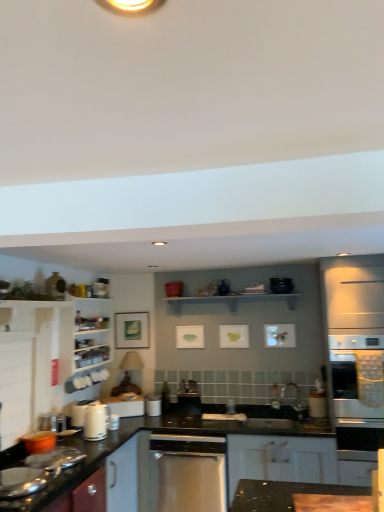
Describe the element at coordinates (317, 404) in the screenshot. I see `white glossy microwave at right, arranged as the first appliance when viewed from the front` at that location.

What is the approximate width of stainless steel oven at right?

The width of stainless steel oven at right is 64.22 centimeters.

Measure the distance between satin stainless steel dishwasher at center and camera.

A distance of 3.15 meters exists between satin stainless steel dishwasher at center and camera.

Locate an element on the screen. black glossy countertop at lower left, which is the 1th countertop in back-to-front order is located at coordinates (79, 464).

Is point (320, 399) farther from viewer compared to point (6, 506)?

Yes, point (320, 399) is behind point (6, 506).

Is white glossy microwave at right, which ranks as the first appliance in right-to-left order, thinner than black glossy countertop at lower left, the 2th countertop viewed from the top?

Correct, the width of white glossy microwave at right, which ranks as the first appliance in right-to-left order, is less than that of black glossy countertop at lower left, the 2th countertop viewed from the top.

From a real-world perspective, is white glossy microwave at right, arranged as the 2th appliance when viewed from the back, above or below black glossy countertop at lower left, which ranks as the second countertop in right-to-left order?

white glossy microwave at right, arranged as the 2th appliance when viewed from the back, is above black glossy countertop at lower left, which ranks as the second countertop in right-to-left order.

Between brown wooden countertop at lower right, placed as the 2th countertop when sorted from bottom to top, and white glossy microwave at right, acting as the 2th appliance starting from the left, which one has less height?

Standing shorter between the two is brown wooden countertop at lower right, placed as the 2th countertop when sorted from bottom to top.

Is brown wooden countertop at lower right, the 1th countertop when ordered from front to back, bigger or smaller than white glossy microwave at right, which ranks as the first appliance in right-to-left order?

brown wooden countertop at lower right, the 1th countertop when ordered from front to back, is bigger than white glossy microwave at right, which ranks as the first appliance in right-to-left order.

In the image, is brown wooden countertop at lower right, which is the first countertop from top to bottom, positioned in front of or behind white glossy microwave at right, which ranks as the first appliance in right-to-left order?

brown wooden countertop at lower right, which is the first countertop from top to bottom, is positioned closer to the viewer than white glossy microwave at right, which ranks as the first appliance in right-to-left order.

From a real-world perspective, is brown wooden countertop at lower right, which appears as the 2th countertop when viewed from the back, positioned under white glossy microwave at right, acting as the 2th appliance starting from the left, based on gravity?

Correct, in the physical world, brown wooden countertop at lower right, which appears as the 2th countertop when viewed from the back, is lower than white glossy microwave at right, acting as the 2th appliance starting from the left.

From a real-world perspective, is white glossy microwave at right, arranged as the first appliance when viewed from the front, located higher than white glossy kettle at lower left?

Yes, from a real-world perspective, white glossy microwave at right, arranged as the first appliance when viewed from the front, is over white glossy kettle at lower left

Which is behind, white glossy microwave at right, which ranks as the first appliance in right-to-left order, or white glossy kettle at lower left?

white glossy microwave at right, which ranks as the first appliance in right-to-left order, is behind.

Considering the relative sizes of white glossy microwave at right, acting as the 2th appliance starting from the left, and white glossy kettle at lower left in the image provided, is white glossy microwave at right, acting as the 2th appliance starting from the left, shorter than white glossy kettle at lower left?

Indeed, white glossy microwave at right, acting as the 2th appliance starting from the left, has a lesser height compared to white glossy kettle at lower left.

Between point (312, 392) and point (89, 440), which one is positioned behind?

The point (312, 392) is farther from the camera.

Which of these two, black glossy countertop at lower left, which is counted as the first countertop, starting from the bottom, or white glossy microwave at right, acting as the 2th appliance starting from the left, is bigger?

With larger size is black glossy countertop at lower left, which is counted as the first countertop, starting from the bottom.

Measure the distance from black glossy countertop at lower left, the 2th countertop viewed from the top, to white glossy microwave at right, acting as the 2th appliance starting from the left.

black glossy countertop at lower left, the 2th countertop viewed from the top, is 1.83 meters away from white glossy microwave at right, acting as the 2th appliance starting from the left.

How different are the orientations of black glossy countertop at lower left, the first countertop from the left, and white glossy microwave at right, which ranks as the first appliance in right-to-left order, in degrees?

black glossy countertop at lower left, the first countertop from the left, and white glossy microwave at right, which ranks as the first appliance in right-to-left order, are facing 89.3 degrees away from each other.

From a real-world perspective, is black glossy countertop at lower left, the first countertop from the left, beneath white glossy microwave at right, arranged as the first appliance when viewed from the front?

Correct, in the physical world, black glossy countertop at lower left, the first countertop from the left, is lower than white glossy microwave at right, arranged as the first appliance when viewed from the front.

Is white glossy cabinet at left, which is counted as the 2th cabinetry, starting from the right, wider than white matte cabinet at lower center, which ranks as the second cabinetry in left-to-right order?

In fact, white glossy cabinet at left, which is counted as the 2th cabinetry, starting from the right, might be narrower than white matte cabinet at lower center, which ranks as the second cabinetry in left-to-right order.

Is white glossy cabinet at left, which is counted as the 2th cabinetry, starting from the right, far away from white matte cabinet at lower center, which ranks as the second cabinetry in left-to-right order?

Indeed, white glossy cabinet at left, which is counted as the 2th cabinetry, starting from the right, is not near white matte cabinet at lower center, which ranks as the second cabinetry in left-to-right order.

From a real-world perspective, is white glossy cabinet at left, which is the 2th cabinetry from bottom to top, beneath white matte cabinet at lower center, which ranks as the second cabinetry in left-to-right order?

No.

Considering the points (76, 359) and (316, 447), which point is behind, point (76, 359) or point (316, 447)?

Positioned behind is point (76, 359).

From a real-world perspective, which is physically above, stainless steel oven at right or white glossy kettle at lower left?

From a 3D spatial view, stainless steel oven at right is above.

From the image's perspective, is stainless steel oven at right located above or below white glossy kettle at lower left?

Clearly, from the image's perspective, stainless steel oven at right is above white glossy kettle at lower left.

How far apart are stainless steel oven at right and white glossy kettle at lower left?

stainless steel oven at right and white glossy kettle at lower left are 1.83 meters apart from each other.

Consider the image. Between stainless steel oven at right and white glossy kettle at lower left, which one has less height?

Standing shorter between the two is white glossy kettle at lower left.

Are white glossy microwave at right, acting as the 2th appliance starting from the left, and brown wooden countertop at lower right, which is counted as the first countertop, starting from the right, far apart?

No, white glossy microwave at right, acting as the 2th appliance starting from the left, is not far away from brown wooden countertop at lower right, which is counted as the first countertop, starting from the right.

Is white glossy microwave at right, acting as the 2th appliance starting from the left, positioned with its back to brown wooden countertop at lower right, placed as the 2th countertop when sorted from bottom to top?

No, white glossy microwave at right, acting as the 2th appliance starting from the left, is not facing the opposite direction of brown wooden countertop at lower right, placed as the 2th countertop when sorted from bottom to top.

From a real-world perspective, which is physically above, white glossy microwave at right, arranged as the first appliance when viewed from the front, or brown wooden countertop at lower right, which appears as the 2th countertop when viewed from the back?

From a 3D spatial view, white glossy microwave at right, arranged as the first appliance when viewed from the front, is above.

The width and height of the screenshot is (384, 512). I want to click on the 1st appliance behind the black glossy countertop at lower left, the 2th countertop viewed from the top, counting from the anchor's position, so click(317, 404).

From the image's perspective, starting from the brown wooden countertop at lower right, which is the second countertop in left-to-right order, which appliance is the 1st one below? Please provide its 2D coordinates.

[(317, 404)]

Looking at the image, which one is located further to satin stainless steel dishwasher at center, satin black dishwasher at center, the second appliance when ordered from right to left, or white glossy kettle at lower left?

white glossy kettle at lower left lies further to satin stainless steel dishwasher at center than the other object.

Based on their spatial positions, is stainless steel oven at right or white matte cabinet at lower center, which ranks as the second cabinetry in left-to-right order, closer to white glossy cabinet at left, which is counted as the 2th cabinetry, starting from the right?

Among the two, white matte cabinet at lower center, which ranks as the second cabinetry in left-to-right order, is located nearer to white glossy cabinet at left, which is counted as the 2th cabinetry, starting from the right.

In the scene shown: Based on their spatial positions, is satin stainless steel dishwasher at center or black glossy countertop at lower left, which is the 1th countertop in back-to-front order, further from white wooden shelf at upper center?

Based on the image, black glossy countertop at lower left, which is the 1th countertop in back-to-front order, appears to be further to white wooden shelf at upper center.

Considering their positions, is white glossy kettle at lower left positioned further to satin black dishwasher at center, the 2th appliance in the front-to-back sequence, than black glossy countertop at lower left, which ranks as the second countertop in right-to-left order?

black glossy countertop at lower left, which ranks as the second countertop in right-to-left order, is further to satin black dishwasher at center, the 2th appliance in the front-to-back sequence.

Estimate the real-world distances between objects in this image. Which object is further from white matte cabinet at lower center, which is the 2th cabinetry from top to bottom, black glossy countertop at lower left, which is the 1th countertop in back-to-front order, or white glossy cabinet at left, which is the 2th cabinetry from bottom to top?

Among the two, white glossy cabinet at left, which is the 2th cabinetry from bottom to top, is located further to white matte cabinet at lower center, which is the 2th cabinetry from top to bottom.

Looking at the image, which one is located closer to white glossy kettle at lower left, white matte cabinet at lower center, which ranks as the 1th cabinetry in bottom-to-top order, or white glossy microwave at right, which ranks as the first appliance in right-to-left order?

The object closer to white glossy kettle at lower left is white matte cabinet at lower center, which ranks as the 1th cabinetry in bottom-to-top order.

Looking at the image, which one is located further to stainless steel oven at right, white glossy kettle at lower left or white matte cabinet at lower center, which is the 2th cabinetry from top to bottom?

Among the two, white glossy kettle at lower left is located further to stainless steel oven at right.

From the image, which object appears to be farther from white glossy microwave at right, arranged as the 2th appliance when viewed from the back, white matte cabinet at lower center, which ranks as the 1th cabinetry in bottom-to-top order, or black glossy countertop at lower left, the first countertop from the left?

The object further to white glossy microwave at right, arranged as the 2th appliance when viewed from the back, is black glossy countertop at lower left, the first countertop from the left.

Find the location of a particular element. shelf between white glossy cabinet at left, which ranks as the first cabinetry in top-to-bottom order, and stainless steel oven at right, in the horizontal direction is located at coordinates (232, 300).

Find the location of a particular element. cabinetry located between white glossy cabinet at left, which ranks as the first cabinetry in top-to-bottom order, and stainless steel oven at right in the left-right direction is located at coordinates (280, 459).

Locate an element on the screen. This screenshot has width=384, height=512. kitchen appliance between brown wooden countertop at lower right, the 1th countertop when ordered from front to back, and satin stainless steel dishwasher at center in the front-back direction is located at coordinates (96, 421).

Identify the location of shelf situated between white glossy cabinet at left, which is the 2th cabinetry from bottom to top, and white glossy microwave at right, arranged as the 2th appliance when viewed from the back, from left to right. (232, 300).